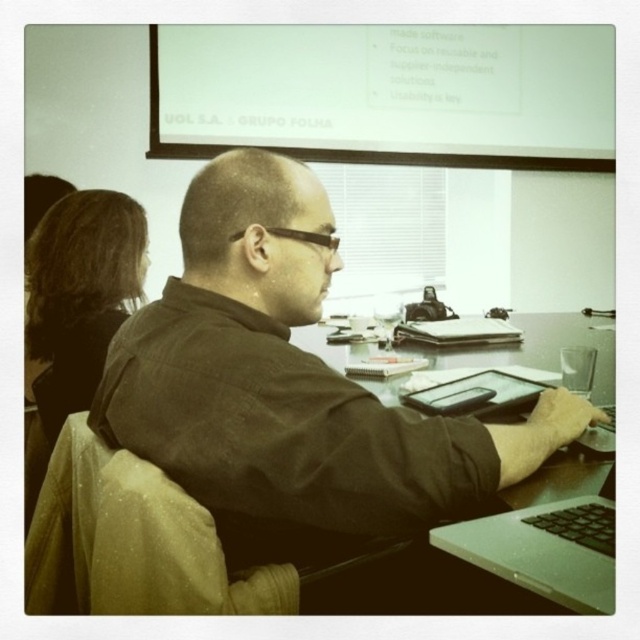
You are a guest entering the room and want to sit at the silver metallic computer desk at center. However, there is a person with brown hair at upper left. Based on their positions, will you have to walk around them to reach the desk?

The silver metallic computer desk at center is in front of brown hair at upper left, so you would not need to walk around them to reach the desk since the desk is positioned closer to you than the person with brown hair at upper left.

Based on the photo, you are standing in the meeting room and want to reach a specific point in the room. The point is located at coordinates point (230,356). If your arm can reach up to 30 inches, can you reach that point without moving your feet?

The distance of point (230,356) from viewer is 28.99 inches, so yes, you can reach that point since it is within your arm reach of 30 inches.

Looking at this image, you are a photographer trying to capture a clear shot of the silver metallic computer desk at center and the brown hair at upper left. Based on their positions, which object should you focus on first to ensure both are in frame?

The silver metallic computer desk at center is positioned under brown hair at upper left, so you should focus on the brown hair at upper left first to ensure both are in frame.